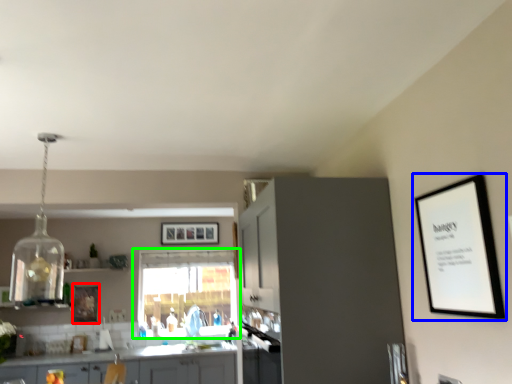
Question: Estimate the real-world distances between objects in this image. Which object is farther from picture frame (highlighted by a red box), picture frame (highlighted by a blue box) or window (highlighted by a green box)?

Choices:
 (A) picture frame
 (B) window

Answer: (A)